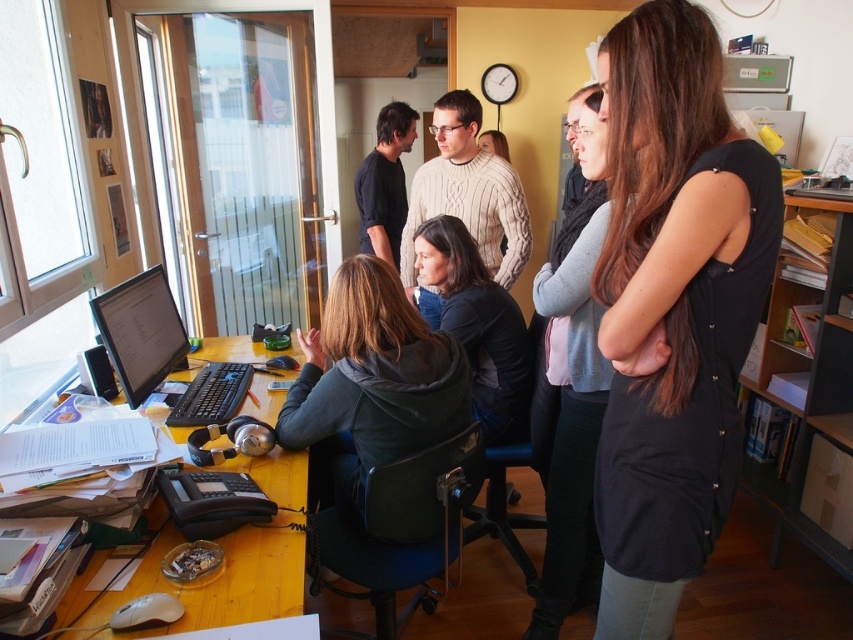
Question: Which of the following is the closest to the observer?

Choices:
 (A) (767, 225)
 (B) (573, 355)
 (C) (519, 428)
 (D) (166, 304)

Answer: (A)

Question: Among these objects, which one is nearest to the camera?

Choices:
 (A) black matte jacket at center
 (B) gray sweater at center
 (C) black matte dress at right
 (D) matte black monitor at left

Answer: (C)

Question: Is yellow wood computer desk at lower left to the left of matte black monitor at left from the viewer's perspective?

Choices:
 (A) yes
 (B) no

Answer: (B)

Question: Is yellow wood computer desk at lower left positioned behind black matte jacket at center?

Choices:
 (A) no
 (B) yes

Answer: (A)

Question: Among these points, which one is nearest to the camera?

Choices:
 (A) (650, 476)
 (B) (239, 588)
 (C) (488, 284)
 (D) (569, 321)

Answer: (A)

Question: Is black matte dress at right further to the viewer compared to yellow wood computer desk at lower left?

Choices:
 (A) no
 (B) yes

Answer: (A)